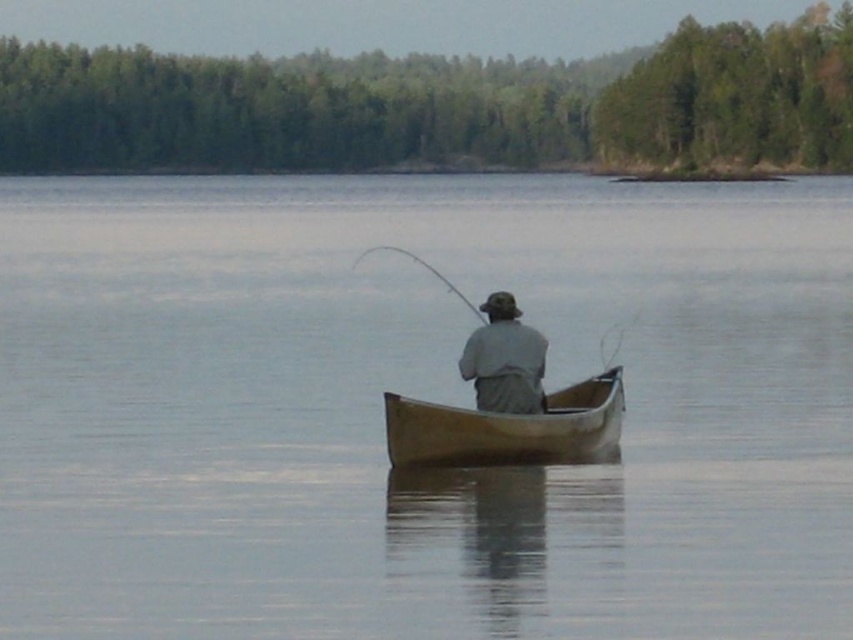
Where is `wooden canoe at center`? wooden canoe at center is located at coordinates (508, 428).

Can you confirm if wooden canoe at center is positioned to the right of flexible fiberglass rod at center?

Indeed, wooden canoe at center is positioned on the right side of flexible fiberglass rod at center.

The height and width of the screenshot is (640, 853). What do you see at coordinates (508, 428) in the screenshot?
I see `wooden canoe at center` at bounding box center [508, 428].

Find the location of `wooden canoe at center`. wooden canoe at center is located at coordinates (508, 428).

Which is behind, point (288, 552) or point (515, 400)?

Positioned behind is point (515, 400).

Can you confirm if clear water at center is wider than gray fabric fisherman at center?

Indeed, clear water at center has a greater width compared to gray fabric fisherman at center.

The height and width of the screenshot is (640, 853). What do you see at coordinates (418, 396) in the screenshot?
I see `clear water at center` at bounding box center [418, 396].

Identify the location of clear water at center. (418, 396).

Is point (312, 186) farther from camera compared to point (445, 448)?

Yes, point (312, 186) is farther from viewer.

Is clear water at center to the right of wooden canoe at center from the viewer's perspective?

Yes, clear water at center is to the right of wooden canoe at center.

Between point (659, 257) and point (428, 452), which one is positioned behind?

The point (659, 257) is more distant.

The height and width of the screenshot is (640, 853). In order to click on clear water at center in this screenshot , I will do `click(418, 396)`.